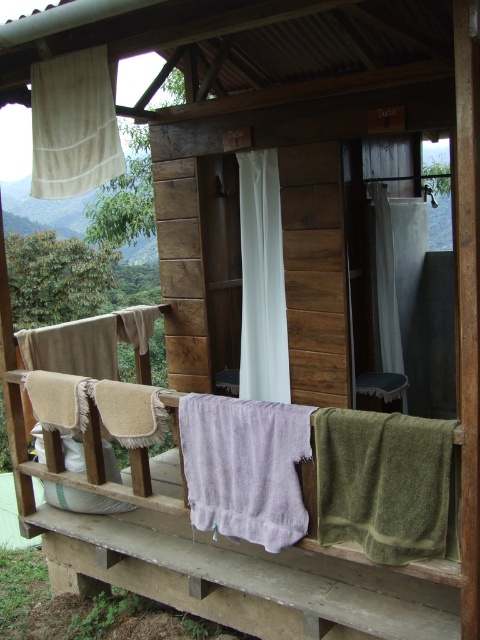
Question: Which point is farther from the camera taking this photo?

Choices:
 (A) (193, 481)
 (B) (92, 67)
 (C) (447, 468)
 (D) (372, 188)

Answer: (D)

Question: Is green fuzzy towel at lower right to the right of beige fabric curtain at upper left from the viewer's perspective?

Choices:
 (A) yes
 (B) no

Answer: (A)

Question: Which point appears farthest from the camera in this image?

Choices:
 (A) (266, 225)
 (B) (68, 109)

Answer: (A)

Question: Does lavender terry towel at center have a larger size compared to beige fabric curtain at upper left?

Choices:
 (A) yes
 (B) no

Answer: (A)

Question: Can you confirm if lavender terry towel at center is positioned above white fabric curtain at center?

Choices:
 (A) no
 (B) yes

Answer: (A)

Question: Among these points, which one is farthest from the camera?

Choices:
 (A) (196, 493)
 (B) (40, 104)

Answer: (B)